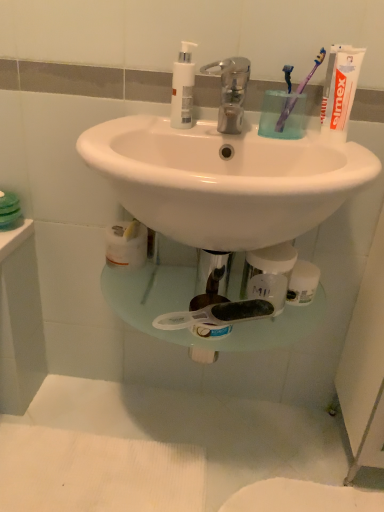
The width and height of the screenshot is (384, 512). Find the location of `white plastic pump bottle at upper center`. white plastic pump bottle at upper center is located at coordinates (183, 87).

The width and height of the screenshot is (384, 512). Identify the location of metallic faucet at center. (230, 91).

Between metallic faucet at center and white matte toothpaste at upper right, which one has larger width?

With larger width is metallic faucet at center.

Can you tell me how much metallic faucet at center and white matte toothpaste at upper right differ in facing direction?

8.02e-05 degrees.

Is metallic faucet at center taller than white matte toothpaste at upper right?

Incorrect, the height of metallic faucet at center is not larger of that of white matte toothpaste at upper right.

Could you tell me if metallic faucet at center is facing white matte toothpaste at upper right?

No, metallic faucet at center is not aimed at white matte toothpaste at upper right.

Does white plastic pump bottle at upper center have a greater width compared to metallic faucet at center?

No.

Which of these two, white plastic pump bottle at upper center or metallic faucet at center, stands shorter?

Standing shorter between the two is metallic faucet at center.

Does point (184, 70) come behind point (297, 89)?

No.

Does white plastic pump bottle at upper center touch purple plastic toothbrush at upper right, which is counted as the second toothbrush, starting from the left?

No, white plastic pump bottle at upper center is not in contact with purple plastic toothbrush at upper right, which is counted as the second toothbrush, starting from the left.

Considering the relative sizes of white plastic pump bottle at upper center and purple plastic toothbrush at upper right, which is counted as the second toothbrush, starting from the left, in the image provided, is white plastic pump bottle at upper center wider than purple plastic toothbrush at upper right, which is counted as the second toothbrush, starting from the left,?

Incorrect, the width of white plastic pump bottle at upper center does not surpass that of purple plastic toothbrush at upper right, which is counted as the second toothbrush, starting from the left.

From a real-world perspective, is purple plastic toothbrush at upper right, the first toothbrush in the right-to-left sequence, physically located above or below purple plastic toothbrush at upper right, placed as the 1th toothbrush when sorted from left to right?

purple plastic toothbrush at upper right, the first toothbrush in the right-to-left sequence, is above purple plastic toothbrush at upper right, placed as the 1th toothbrush when sorted from left to right.

Is the position of purple plastic toothbrush at upper right, which is counted as the second toothbrush, starting from the left, less distant than that of purple plastic toothbrush at upper right, placed as the 1th toothbrush when sorted from left to right?

Yes, the depth of purple plastic toothbrush at upper right, which is counted as the second toothbrush, starting from the left, is less than that of purple plastic toothbrush at upper right, placed as the 1th toothbrush when sorted from left to right.

Considering the points (282, 110) and (285, 119), which point is in front, point (282, 110) or point (285, 119)?

The point (282, 110) is closer to the camera.

Is purple plastic toothbrush at upper right, which is counted as the second toothbrush, starting from the left, not near purple plastic toothbrush at upper right, positioned as the second toothbrush in right-to-left order?

Actually, purple plastic toothbrush at upper right, which is counted as the second toothbrush, starting from the left, and purple plastic toothbrush at upper right, positioned as the second toothbrush in right-to-left order, are a little close together.

Relative to white matte toothpaste at upper right, is purple plastic toothbrush at upper right, the first toothbrush in the right-to-left sequence, in front or behind?

purple plastic toothbrush at upper right, the first toothbrush in the right-to-left sequence, is behind white matte toothpaste at upper right.

From the image's perspective, is purple plastic toothbrush at upper right, the first toothbrush in the right-to-left sequence, beneath white matte toothpaste at upper right?

Actually, purple plastic toothbrush at upper right, the first toothbrush in the right-to-left sequence, appears above white matte toothpaste at upper right in the image.

Is point (294, 106) positioned after point (332, 126)?

Yes, point (294, 106) is farther from viewer.

Looking at this image, considering the sizes of purple plastic toothbrush at upper right, which is counted as the second toothbrush, starting from the left, and white matte toothpaste at upper right in the image, is purple plastic toothbrush at upper right, which is counted as the second toothbrush, starting from the left, taller or shorter than white matte toothpaste at upper right?

Clearly, purple plastic toothbrush at upper right, which is counted as the second toothbrush, starting from the left, is taller compared to white matte toothpaste at upper right.

Considering the relative positions of metallic faucet at center and purple plastic toothbrush at upper right, which is counted as the second toothbrush, starting from the left, in the image provided, is metallic faucet at center to the left or to the right of purple plastic toothbrush at upper right, which is counted as the second toothbrush, starting from the left,?

Clearly, metallic faucet at center is on the left of purple plastic toothbrush at upper right, which is counted as the second toothbrush, starting from the left, in the image.

Is metallic faucet at center smaller than purple plastic toothbrush at upper right, the first toothbrush in the right-to-left sequence?

No, metallic faucet at center is not smaller than purple plastic toothbrush at upper right, the first toothbrush in the right-to-left sequence.

Are metallic faucet at center and purple plastic toothbrush at upper right, which is counted as the second toothbrush, starting from the left, beside each other?

There is a gap between metallic faucet at center and purple plastic toothbrush at upper right, which is counted as the second toothbrush, starting from the left.

What's the angular difference between metallic faucet at center and purple plastic toothbrush at upper right, which is counted as the second toothbrush, starting from the left,'s facing directions?

They differ by 3.79e-05 degrees in their facing directions.

From a real-world perspective, who is located lower, white matte toothpaste at upper right or purple plastic toothbrush at upper right, which is counted as the second toothbrush, starting from the left?

purple plastic toothbrush at upper right, which is counted as the second toothbrush, starting from the left, is physically lower.

From the picture: Who is smaller, white matte toothpaste at upper right or purple plastic toothbrush at upper right, the first toothbrush in the right-to-left sequence?

Smaller between the two is white matte toothpaste at upper right.

From the image's perspective, which toothbrush is the 2nd one above the white matte toothpaste at upper right? Please provide its 2D coordinates.

[(298, 93)]

Is point (336, 134) closer to viewer compared to point (279, 128)?

Yes, point (336, 134) is closer to viewer.

At what (x,y) coordinates should I click in order to perform the action: click on toothpaste on the right of metallic faucet at center. Please return your answer as a coordinate pair (x, y). Image resolution: width=384 pixels, height=512 pixels. Looking at the image, I should click on (340, 90).

Where is `tap in front of the white plastic pump bottle at upper center`? tap in front of the white plastic pump bottle at upper center is located at coordinates pos(230,91).

When comparing their distances from metallic faucet at center, does white matte toothpaste at upper right or white plastic pump bottle at upper center seem closer?

white plastic pump bottle at upper center is closer to metallic faucet at center.

Which object lies nearer to the anchor point purple plastic toothbrush at upper right, which is counted as the second toothbrush, starting from the left, metallic faucet at center or white matte toothpaste at upper right?

Based on the image, white matte toothpaste at upper right appears to be nearer to purple plastic toothbrush at upper right, which is counted as the second toothbrush, starting from the left.

When comparing their distances from white matte toothpaste at upper right, does white plastic pump bottle at upper center or purple plastic toothbrush at upper right, placed as the 1th toothbrush when sorted from left to right, seem further?

Among the two, white plastic pump bottle at upper center is located further to white matte toothpaste at upper right.

Estimate the real-world distances between objects in this image. Which object is closer to purple plastic toothbrush at upper right, placed as the 1th toothbrush when sorted from left to right, white plastic pump bottle at upper center or purple plastic toothbrush at upper right, the first toothbrush in the right-to-left sequence?

purple plastic toothbrush at upper right, the first toothbrush in the right-to-left sequence, lies closer to purple plastic toothbrush at upper right, placed as the 1th toothbrush when sorted from left to right, than the other object.

Considering their positions, is purple plastic toothbrush at upper right, which is counted as the second toothbrush, starting from the left, positioned further to purple plastic toothbrush at upper right, placed as the 1th toothbrush when sorted from left to right, than metallic faucet at center?

metallic faucet at center is positioned further to the anchor purple plastic toothbrush at upper right, placed as the 1th toothbrush when sorted from left to right.

When comparing their distances from white plastic pump bottle at upper center, does white matte toothpaste at upper right or purple plastic toothbrush at upper right, which is counted as the second toothbrush, starting from the left, seem closer?

Based on the image, purple plastic toothbrush at upper right, which is counted as the second toothbrush, starting from the left, appears to be nearer to white plastic pump bottle at upper center.

From the image, which object appears to be nearer to purple plastic toothbrush at upper right, which is counted as the second toothbrush, starting from the left, purple plastic toothbrush at upper right, positioned as the second toothbrush in right-to-left order, or white matte toothpaste at upper right?

purple plastic toothbrush at upper right, positioned as the second toothbrush in right-to-left order, lies closer to purple plastic toothbrush at upper right, which is counted as the second toothbrush, starting from the left, than the other object.

Based on their spatial positions, is purple plastic toothbrush at upper right, which is counted as the second toothbrush, starting from the left, or white matte toothpaste at upper right further from metallic faucet at center?

white matte toothpaste at upper right is positioned further to the anchor metallic faucet at center.

Where is `toothbrush located between white matte toothpaste at upper right and purple plastic toothbrush at upper right, placed as the 1th toothbrush when sorted from left to right, in the depth direction`? toothbrush located between white matte toothpaste at upper right and purple plastic toothbrush at upper right, placed as the 1th toothbrush when sorted from left to right, in the depth direction is located at coordinates (298, 93).

In order to click on tap situated between white plastic pump bottle at upper center and purple plastic toothbrush at upper right, positioned as the second toothbrush in right-to-left order, from left to right in this screenshot , I will do `click(230, 91)`.

What are the coordinates of `toothbrush between white plastic pump bottle at upper center and purple plastic toothbrush at upper right, the first toothbrush in the right-to-left sequence, in the horizontal direction` in the screenshot? It's located at (288, 76).

This screenshot has height=512, width=384. I want to click on toothbrush between metallic faucet at center and purple plastic toothbrush at upper right, the first toothbrush in the right-to-left sequence, from left to right, so click(288, 76).